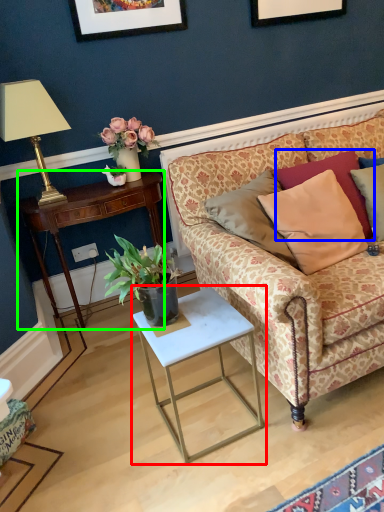
Question: Which is farther away from table (highlighted by a red box)? pillow (highlighted by a blue box) or desk (highlighted by a green box)?

Choices:
 (A) pillow
 (B) desk

Answer: (B)